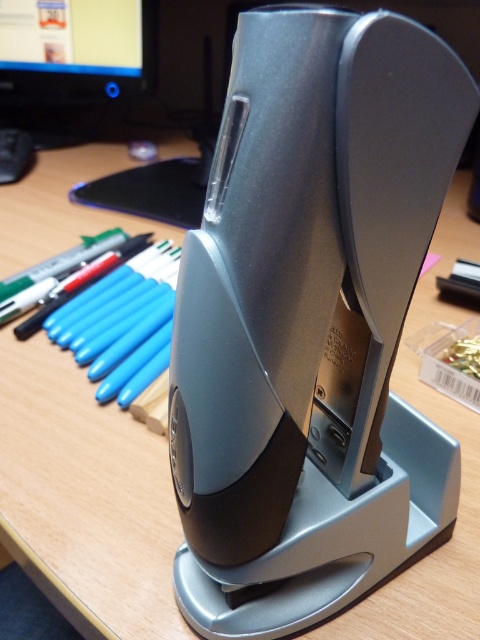
Question: Is satin silver stapler at center to the left of matte black monitor at upper left from the viewer's perspective?

Choices:
 (A) yes
 (B) no

Answer: (B)

Question: Among these points, which one is farthest from the camera?

Choices:
 (A) (11, 36)
 (B) (227, 262)
 (C) (63, 336)
 (D) (16, 157)

Answer: (A)

Question: Which object appears closest to the camera in this image?

Choices:
 (A) blue plastic pencil at center
 (B) black plastic mouse at upper left
 (C) satin silver stapler at center

Answer: (C)

Question: Can you confirm if satin silver stapler at center is smaller than black plastic mouse at upper left?

Choices:
 (A) yes
 (B) no

Answer: (B)

Question: Which object is farther from the camera taking this photo?

Choices:
 (A) black plastic mouse at upper left
 (B) matte black monitor at upper left

Answer: (A)

Question: Is satin silver stapler at center thinner than blue plastic pencil at center?

Choices:
 (A) yes
 (B) no

Answer: (B)